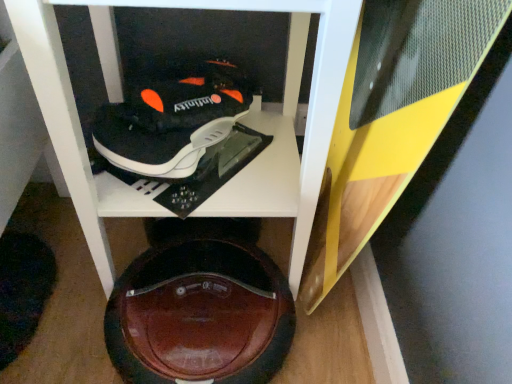
Question: Is shiny brown shoe at bottom center in front of or behind wooden cabinet at center in the image?

Choices:
 (A) behind
 (B) front

Answer: (A)

Question: Is point pos(236,307) positioned closer to the camera than point pos(55,79)?

Choices:
 (A) farther
 (B) closer

Answer: (A)

Question: Which is farther from the shiny brown shoe at bottom center?

Choices:
 (A) wooden cabinet at center
 (B) black matte shoe at upper center

Answer: (B)

Question: Estimate the real-world distances between objects in this image. Which object is closer to the black matte shoe at upper center?

Choices:
 (A) shiny brown shoe at bottom center
 (B) wooden cabinet at center

Answer: (B)